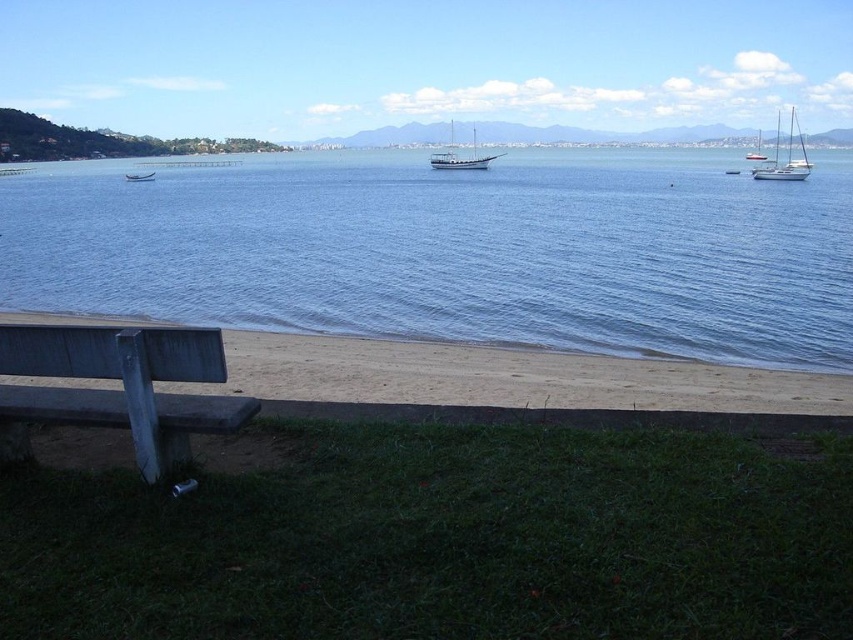
From the picture: You are standing at the concrete bench on the left side of the grassy area. Looking towards the water, you notice a specific point marked at coordinates (451, 250). What is located at that point?

The blue water at center is located at point (451, 250).